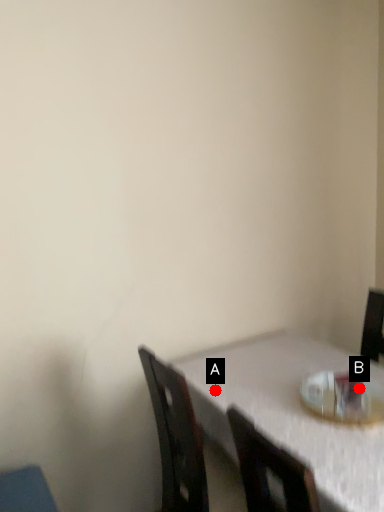
Question: Two points are circled on the image, labeled by A and B beside each circle. Which point appears closest to the camera in this image?

Choices:
 (A) A is closer
 (B) B is closer

Answer: (B)